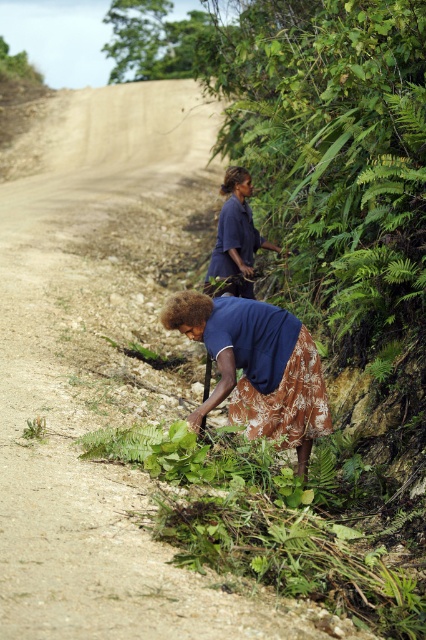
Who is positioned more to the left, brown floral skirt at lower center or dark blue fabric at center?

Positioned to the left is dark blue fabric at center.

Can you confirm if brown floral skirt at lower center is thinner than dark blue fabric at center?

In fact, brown floral skirt at lower center might be wider than dark blue fabric at center.

Is point (322, 392) less distant than point (221, 252)?

Yes, it is.

In order to click on brown floral skirt at lower center in this screenshot , I will do `click(256, 368)`.